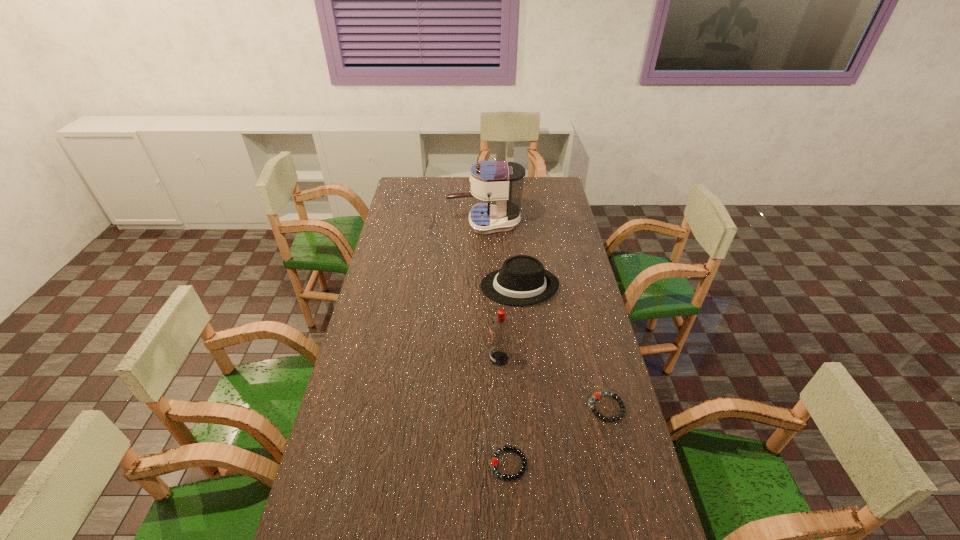
Identify the location of vacant space positioned 0.270m on the front-facing side of the farthest object. (391, 223).

You are a GUI agent. You are given a task and a screenshot of the screen. Output one action in this format:
    pyautogui.click(x=<x>, y=<y>)
    Task: Click on the blank space located on the front-facing side of the farthest object
    This screenshot has height=540, width=960.
    Given the screenshot: What is the action you would take?
    pyautogui.click(x=420, y=223)

This screenshot has width=960, height=540. What are the coordinates of `blank area located 0.250m on the front-facing side of the farthest object` in the screenshot? It's located at (395, 223).

Where is `vacant space located 0.150m on the front label of the vodka`? vacant space located 0.150m on the front label of the vodka is located at coordinates (444, 359).

The image size is (960, 540). I want to click on free space located 0.210m on the front label of the vodka, so click(426, 359).

Identify the location of vacant region located on the front label of the vodka. This screenshot has height=540, width=960. (381, 359).

Image resolution: width=960 pixels, height=540 pixels. I want to click on vacant space located on the front-facing side of the third tallest object, so click(x=381, y=286).

Where is `free space located 0.120m on the front-facing side of the third tallest object`? free space located 0.120m on the front-facing side of the third tallest object is located at coordinates (450, 286).

The width and height of the screenshot is (960, 540). I want to click on vacant space located 0.280m on the front-facing side of the third tallest object, so click(x=409, y=286).

Where is `free space located 0.090m on the left of the second nearest object`? free space located 0.090m on the left of the second nearest object is located at coordinates (558, 408).